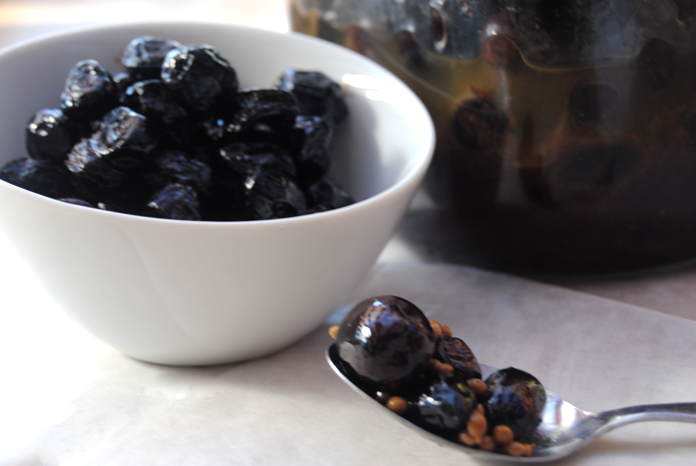
Where is `table`? table is located at coordinates 664,287.